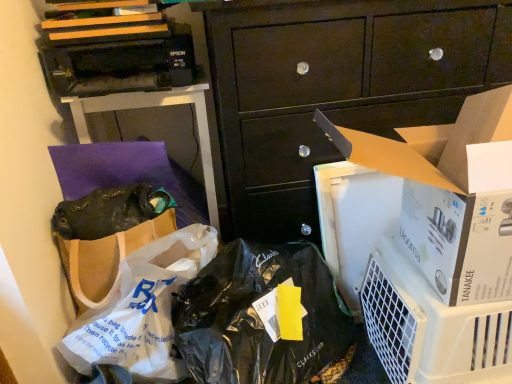
Question: From the image's perspective, is brown paper bag at upper left located beneath white plastic bag at lower left?

Choices:
 (A) no
 (B) yes

Answer: (A)

Question: From the image's perspective, is brown paper bag at upper left on top of white plastic bag at lower left?

Choices:
 (A) no
 (B) yes

Answer: (B)

Question: Would you say brown paper bag at upper left is outside white plastic bag at lower left?

Choices:
 (A) no
 (B) yes

Answer: (B)

Question: Is brown paper bag at upper left oriented away from white plastic bag at lower left?

Choices:
 (A) yes
 (B) no

Answer: (B)

Question: Can you confirm if brown paper bag at upper left is positioned to the right of white plastic bag at lower left?

Choices:
 (A) no
 (B) yes

Answer: (A)

Question: From a real-world perspective, is brown paper bag at upper left under white plastic bag at lower left?

Choices:
 (A) yes
 (B) no

Answer: (B)

Question: Is white cardboard box at center-right to the left of white plastic bag at lower left from the viewer's perspective?

Choices:
 (A) yes
 (B) no

Answer: (B)

Question: Is white cardboard box at center-right taller than white plastic bag at lower left?

Choices:
 (A) yes
 (B) no

Answer: (A)

Question: From the image's perspective, is white cardboard box at center-right over white plastic bag at lower left?

Choices:
 (A) no
 (B) yes

Answer: (B)

Question: Does white cardboard box at center-right have a lesser height compared to white plastic bag at lower left?

Choices:
 (A) no
 (B) yes

Answer: (A)

Question: Is white cardboard box at center-right outside of white plastic bag at lower left?

Choices:
 (A) yes
 (B) no

Answer: (A)

Question: Is white cardboard box at center-right positioned with its back to white plastic bag at lower left?

Choices:
 (A) no
 (B) yes

Answer: (A)

Question: Is brown paper bag at upper left positioned before white plastic air purifier at lower right?

Choices:
 (A) no
 (B) yes

Answer: (A)